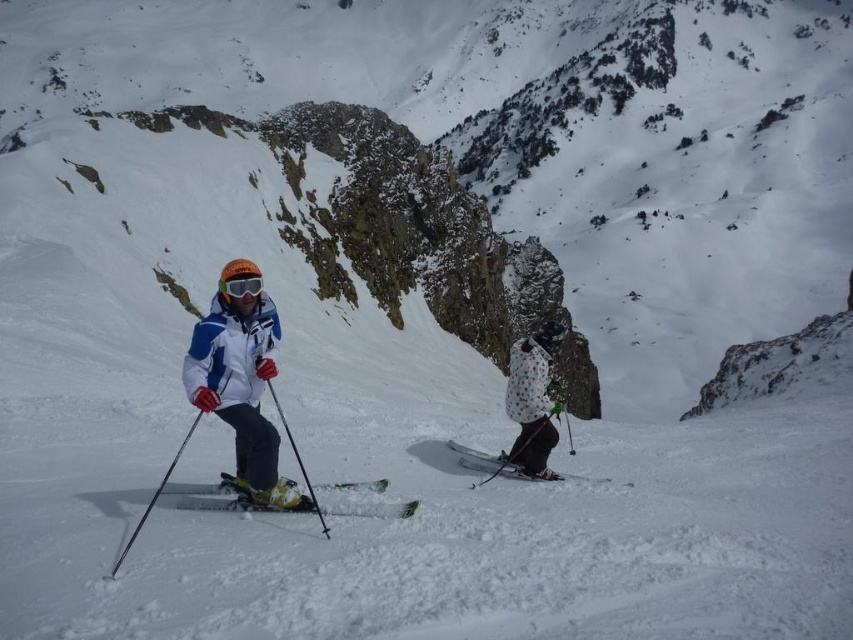
You are a skier trying to locate your friend who is wearing a white jacket with blue accents and orange helmet. You see a point at coordinates [532,400]. Is this point on your friend?

Yes, the point at coordinates [532,400] is on the white dotted jacket at center, which matches the description of your friend wearing a white jacket with blue accents and orange helmet.

You are a skier trying to locate your equipment. You remember that your ski is at a specific coordinate. Which object is located at point (486, 461)?

The white matte ski at center is located at point (486, 461).

You are a photographer trying to capture a clear shot of the transparent orange goggles at center and the black matte ski pole at left. Based on their positions, which object is closer to the camera?

The black matte ski pole at left is positioned under the transparent orange goggles at center, meaning it is closer to the camera.